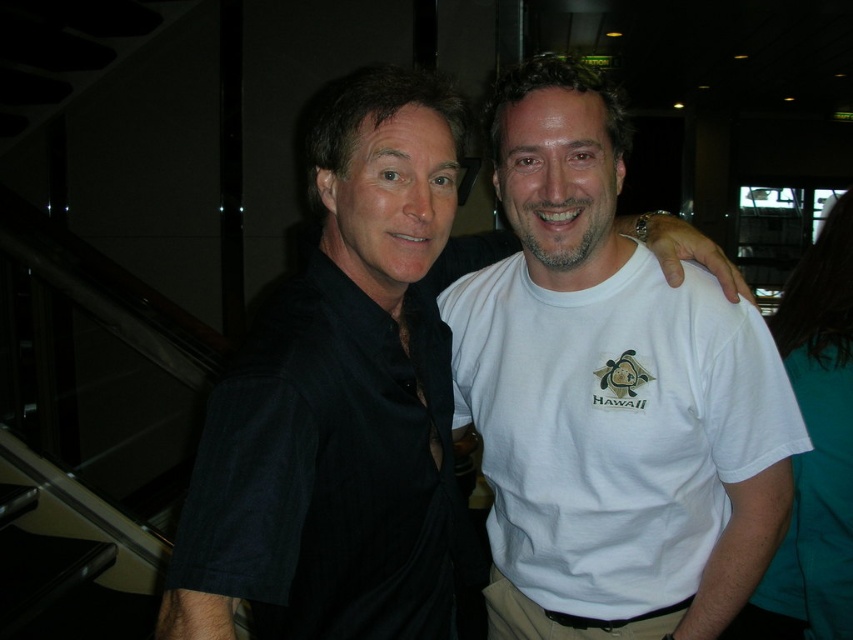
Question: Is white cotton t-shirt at center bigger than black matte shirt at center?

Choices:
 (A) no
 (B) yes

Answer: (B)

Question: Is white cotton t-shirt at center bigger than black matte shirt at center?

Choices:
 (A) yes
 (B) no

Answer: (A)

Question: Among these objects, which one is farthest from the camera?

Choices:
 (A) black matte shirt at center
 (B) white cotton t-shirt at center

Answer: (B)

Question: Does white cotton t-shirt at center appear over black matte shirt at center?

Choices:
 (A) no
 (B) yes

Answer: (A)

Question: Which point is closer to the camera taking this photo?

Choices:
 (A) (318, 308)
 (B) (592, 572)

Answer: (A)